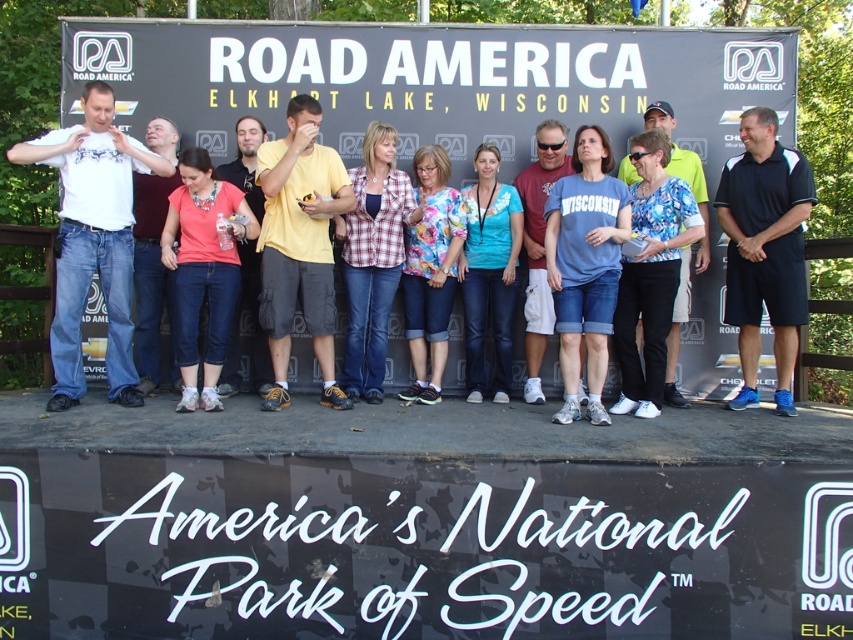
Who is taller, pink fabric shirt at center or blue floral blouse at center?

blue floral blouse at center

Who is positioned more to the right, pink fabric shirt at center or blue floral blouse at center?

Positioned to the right is blue floral blouse at center.

Between point (189, 157) and point (659, 124), which one is positioned in front?

Point (189, 157)

Where is `pink fabric shirt at center`? pink fabric shirt at center is located at coordinates (x=202, y=269).

How much distance is there between yellow cotton shirt at center and plaid shirt at center?

yellow cotton shirt at center and plaid shirt at center are 19.83 inches apart.

What do you see at coordinates (299, 244) in the screenshot? This screenshot has width=853, height=640. I see `yellow cotton shirt at center` at bounding box center [299, 244].

Identify the location of yellow cotton shirt at center. This screenshot has height=640, width=853. (299, 244).

Is point (798, 308) in front of point (436, 241)?

Yes, it is in front of point (436, 241).

Which is above, black/dry fit shirt at right or floral fabric shirt at center?

black/dry fit shirt at right is above.

Where is `black/dry fit shirt at right`? The height and width of the screenshot is (640, 853). black/dry fit shirt at right is located at coordinates (764, 250).

Where is `black/dry fit shirt at right`? black/dry fit shirt at right is located at coordinates (764, 250).